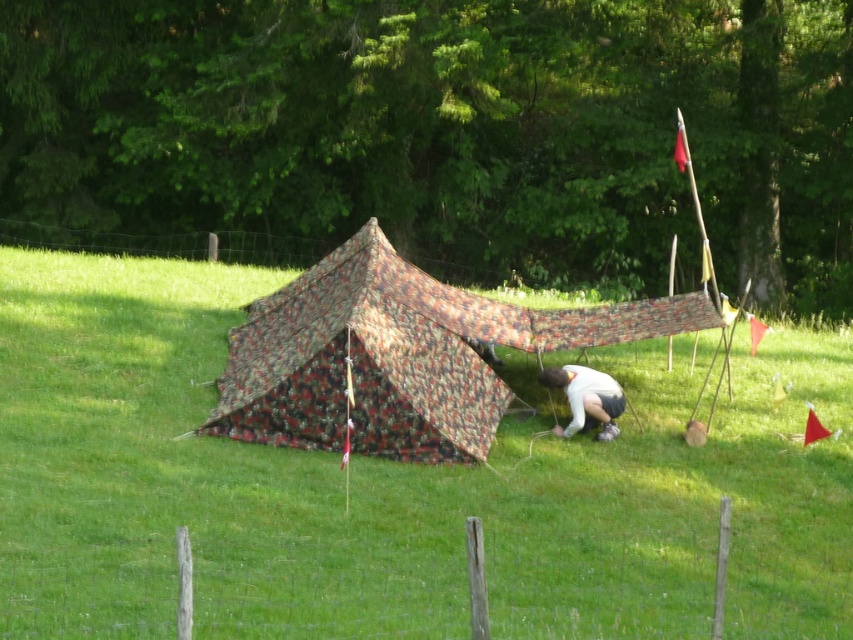
Question: Estimate the real-world distances between objects in this image. Which object is farther from the camouflage fabric tent at center?

Choices:
 (A) white fabric at center
 (B) green grass at center

Answer: (B)

Question: Which object is farther from the camera taking this photo?

Choices:
 (A) camouflage fabric tent at center
 (B) green grass at center
 (C) white fabric at center

Answer: (C)

Question: Which of the following is the closest to the observer?

Choices:
 (A) tap(550, 381)
 (B) tap(10, 433)
 (C) tap(434, 380)

Answer: (B)

Question: Can you confirm if camouflage fabric tent at center is positioned below white fabric at center?

Choices:
 (A) yes
 (B) no

Answer: (B)

Question: Does green grass at center have a smaller size compared to white fabric at center?

Choices:
 (A) yes
 (B) no

Answer: (B)

Question: Does camouflage fabric tent at center have a larger size compared to white fabric at center?

Choices:
 (A) no
 (B) yes

Answer: (B)